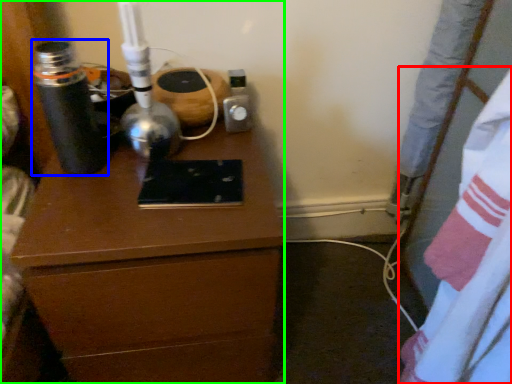
Question: Considering the real-world distances, which object is farthest from sheet (highlighted by a red box)? bottle (highlighted by a blue box) or chest of drawers (highlighted by a green box)?

Choices:
 (A) bottle
 (B) chest of drawers

Answer: (A)